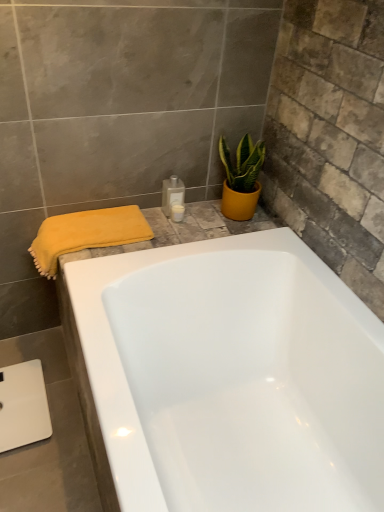
At what (x,y) coordinates should I click in order to perform the action: click on vacant region below yellow matte pot at upper right (from a real-world perspective). Please return your answer as a coordinate pair (x, y). Image resolution: width=384 pixels, height=512 pixels. Looking at the image, I should click on (240, 220).